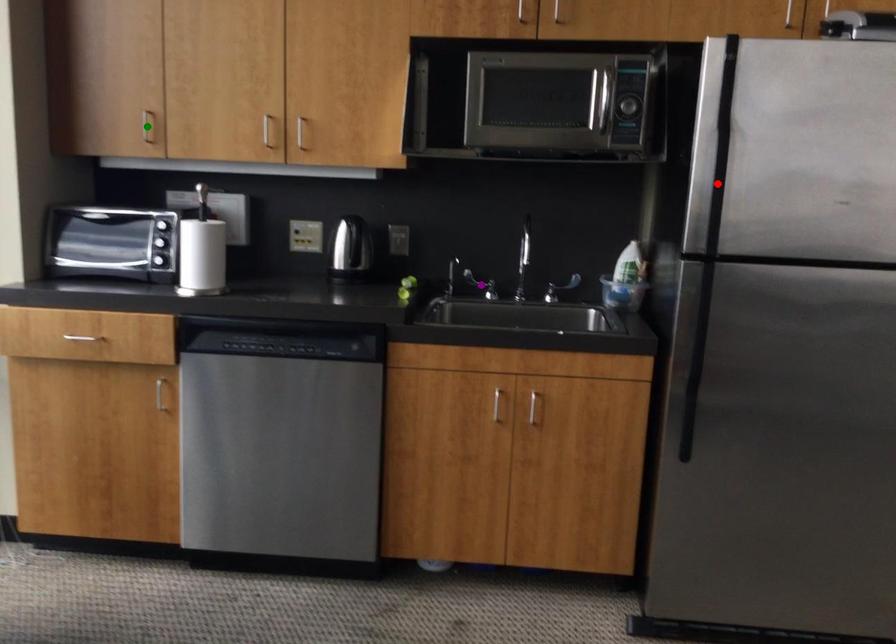
Order these from nearest to farthest:
1. green point
2. purple point
3. red point

1. red point
2. green point
3. purple point